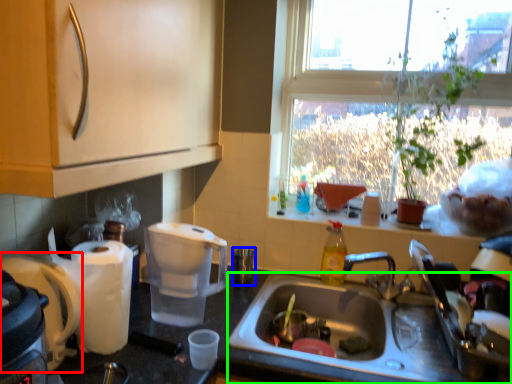
Question: Which is farther away from coffee maker (highlighted by a red box)? coffee cup (highlighted by a blue box) or sink (highlighted by a green box)?

Choices:
 (A) coffee cup
 (B) sink

Answer: (A)